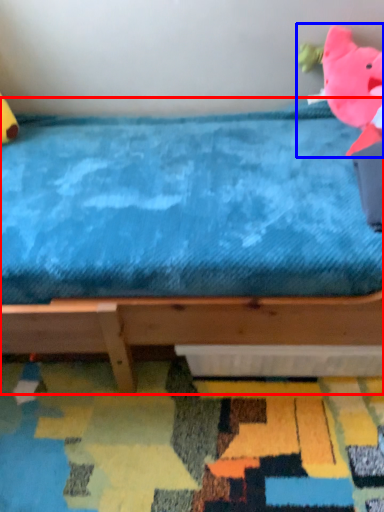
Question: Among these objects, which one is farthest to the camera, bed (highlighted by a red box) or toy (highlighted by a blue box)?

Choices:
 (A) bed
 (B) toy

Answer: (B)